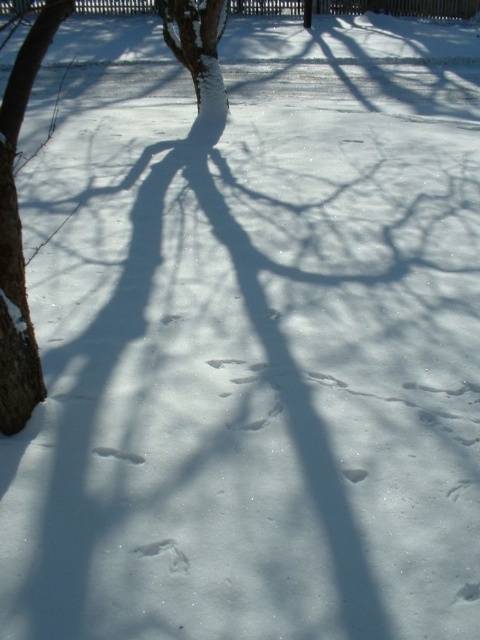
Question: Which of the following is the closest to the observer?

Choices:
 (A) pos(8,150)
 (B) pos(215,3)

Answer: (A)

Question: Is brown rough bark tree at left positioned behind white snow-covered tree at center?

Choices:
 (A) yes
 (B) no

Answer: (B)

Question: Does brown rough bark tree at left have a greater width compared to white snow-covered tree at center?

Choices:
 (A) yes
 (B) no

Answer: (B)

Question: Which point is farther to the camera?

Choices:
 (A) (186, 67)
 (B) (11, 92)

Answer: (A)

Question: Is brown rough bark tree at left closer to camera compared to white snow-covered tree at center?

Choices:
 (A) yes
 (B) no

Answer: (A)

Question: Which point is closer to the camera taking this photo?

Choices:
 (A) (167, 8)
 (B) (25, 67)

Answer: (B)